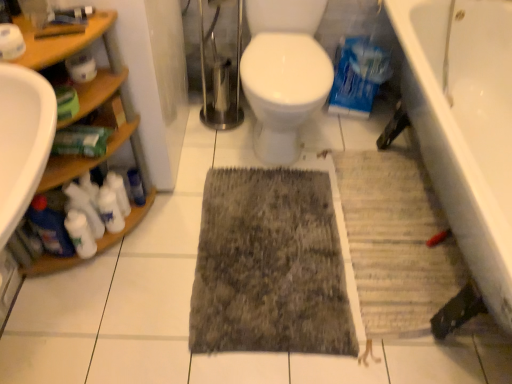
Identify the location of free spot to the right of dark gray textured rug at center. (398, 254).